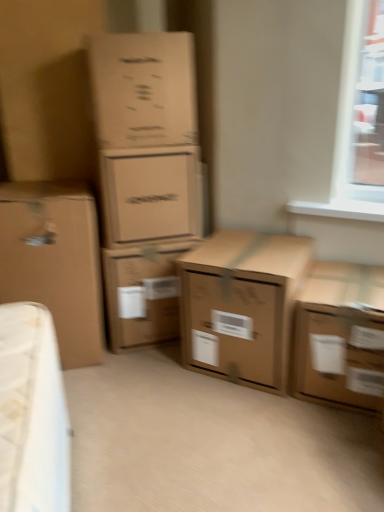
Question: Considering the relative sizes of brown cardboard box at lower right, which appears as the sixth box when viewed from the left, and brown cardboard box at center, the 4th box from the left, in the image provided, is brown cardboard box at lower right, which appears as the sixth box when viewed from the left, taller than brown cardboard box at center, the 4th box from the left,?

Choices:
 (A) no
 (B) yes

Answer: (A)

Question: Are brown cardboard box at lower right, which appears as the sixth box when viewed from the left, and brown cardboard box at center, the third box positioned from the right, beside each other?

Choices:
 (A) no
 (B) yes

Answer: (A)

Question: From the image's perspective, is brown cardboard box at lower right, the 1th box positioned from the right, located beneath brown cardboard box at center, the 4th box from the left?

Choices:
 (A) yes
 (B) no

Answer: (A)

Question: Is brown cardboard box at lower right, the 1th box positioned from the right, not within brown cardboard box at center, the 4th box from the left?

Choices:
 (A) no
 (B) yes

Answer: (B)

Question: Can you confirm if brown cardboard box at lower right, the 1th box positioned from the right, is smaller than brown cardboard box at center, the 4th box from the left?

Choices:
 (A) no
 (B) yes

Answer: (B)

Question: Is brown cardboard box at left, which is counted as the sixth box, starting from the right, to the left or to the right of matte cardboard box at center, marked as the 3th box in a left-to-right arrangement, in the image?

Choices:
 (A) right
 (B) left

Answer: (B)

Question: Is brown cardboard box at left, positioned as the first box in left-to-right order, wider or thinner than matte cardboard box at center, the fourth box when ordered from right to left?

Choices:
 (A) wide
 (B) thin

Answer: (A)

Question: Choose the correct answer: Is brown cardboard box at left, which is counted as the sixth box, starting from the right, inside matte cardboard box at center, the fourth box when ordered from right to left, or outside it?

Choices:
 (A) inside
 (B) outside

Answer: (B)

Question: Relative to matte cardboard box at center, marked as the 3th box in a left-to-right arrangement, is brown cardboard box at left, positioned as the first box in left-to-right order, in front or behind?

Choices:
 (A) behind
 (B) front

Answer: (B)

Question: Do you think brown cardboard box at upper left, the second box viewed from the left, is within brown cardboard box at left, positioned as the first box in left-to-right order, or outside of it?

Choices:
 (A) inside
 (B) outside

Answer: (B)

Question: Is brown cardboard box at upper left, marked as the 5th box in a right-to-left arrangement, to the left or to the right of brown cardboard box at left, which is counted as the sixth box, starting from the right, in the image?

Choices:
 (A) right
 (B) left

Answer: (A)

Question: From a real-world perspective, is brown cardboard box at upper left, the second box viewed from the left, positioned above or below brown cardboard box at left, which is counted as the sixth box, starting from the right?

Choices:
 (A) below
 (B) above

Answer: (B)

Question: Considering the positions of brown cardboard box at upper left, marked as the 5th box in a right-to-left arrangement, and brown cardboard box at left, which is counted as the sixth box, starting from the right, in the image, is brown cardboard box at upper left, marked as the 5th box in a right-to-left arrangement, wider or thinner than brown cardboard box at left, which is counted as the sixth box, starting from the right,?

Choices:
 (A) thin
 (B) wide

Answer: (A)

Question: Considering the positions of brown cardboard box at upper left, the second box viewed from the left, and brown cardboard box at center, the 4th box from the left, in the image, is brown cardboard box at upper left, the second box viewed from the left, taller or shorter than brown cardboard box at center, the 4th box from the left,?

Choices:
 (A) tall
 (B) short

Answer: (B)

Question: Relative to brown cardboard box at center, the 4th box from the left, is brown cardboard box at upper left, marked as the 5th box in a right-to-left arrangement, in front or behind?

Choices:
 (A) front
 (B) behind

Answer: (A)